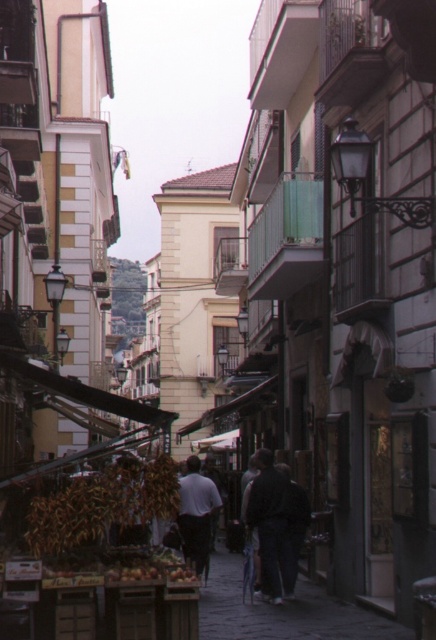
You are a tourist carrying a backpack and want to walk through the narrow street. There is a brown matte dried corn at center and a dark gray jacket at center in your path. Which object do you need to move to pass through?

You need to move the brown matte dried corn at center because it occupies less space than the dark gray jacket at center, making it easier to move out of the way.

You are a tourist standing on the narrow street and want to take a photo of both the dark gray jacket at center and the light gray fabric shirt at center. Which one should you focus on first if you want to capture both in the frame without moving the camera?

The dark gray jacket at center is positioned on the right side of light gray fabric shirt at center, so you should focus on the light gray fabric shirt at center first to ensure both are in the frame.